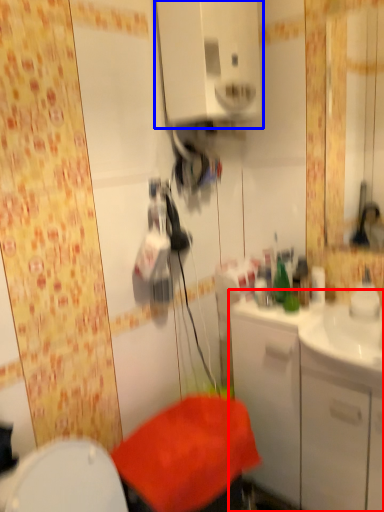
Question: Which point is closer to the camera, bathroom cabinet (highlighted by a red box) or medicine cabinet (highlighted by a blue box)?

Choices:
 (A) bathroom cabinet
 (B) medicine cabinet

Answer: (B)